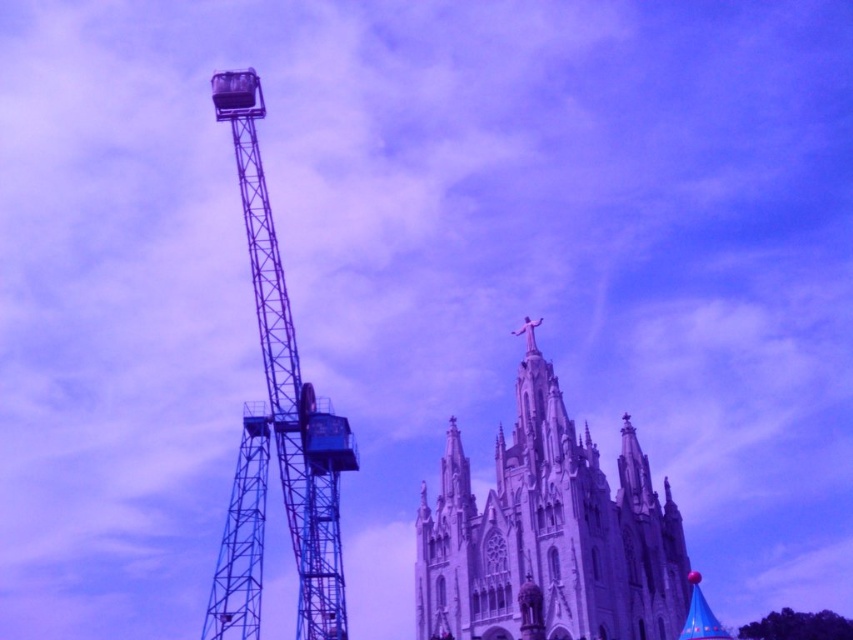
Question: Which object is farther from the camera taking this photo?

Choices:
 (A) metallic blue crane at left
 (B) white stone church at center

Answer: (A)

Question: Does white stone church at center have a lesser width compared to metallic blue crane at left?

Choices:
 (A) no
 (B) yes

Answer: (A)

Question: In this image, where is white stone church at center located relative to metallic blue crane at left?

Choices:
 (A) above
 (B) below

Answer: (B)

Question: Is white stone church at center thinner than metallic blue crane at left?

Choices:
 (A) no
 (B) yes

Answer: (A)